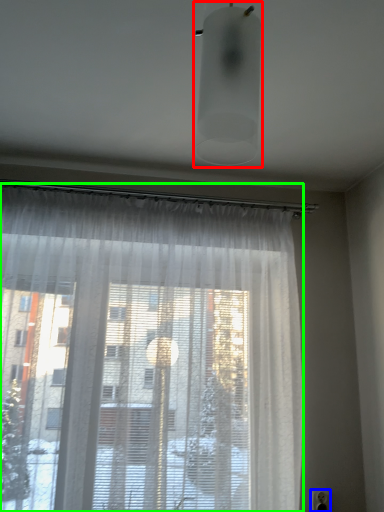
Question: Which object is positioned farthest from light fixture (highlighted by a red box)? Select from electric outlet (highlighted by a blue box) and curtain (highlighted by a green box).

Choices:
 (A) electric outlet
 (B) curtain

Answer: (A)